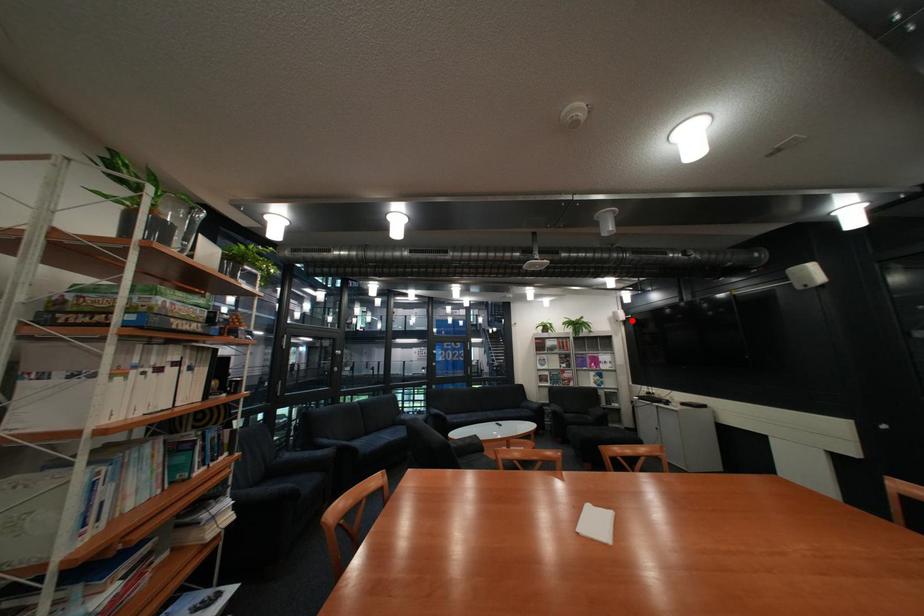
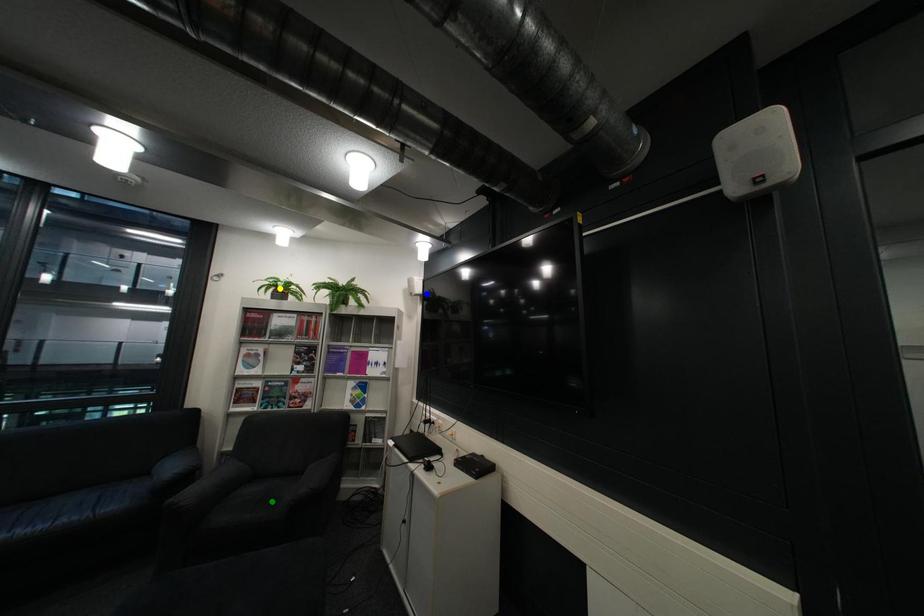
Question: I am providing you with two images of the same scene from different viewpoints. A red point is marked on the first image. You are given multiple points on the second image. Which point in image 2 is actually the same real-world point as the red point in image 1?

Choices:
 (A) green point
 (B) yellow point
 (C) blue point

Answer: (C)